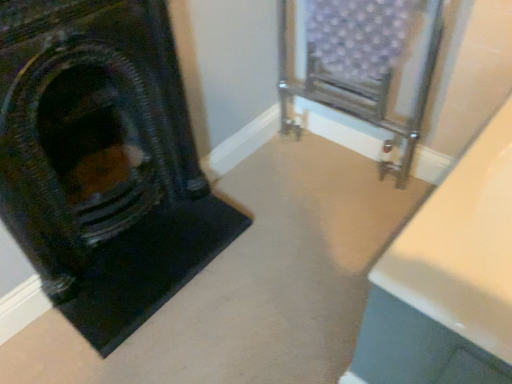
Locate an element on the screen. The height and width of the screenshot is (384, 512). vacant area that is in front of metallic radiator at center is located at coordinates (333, 210).